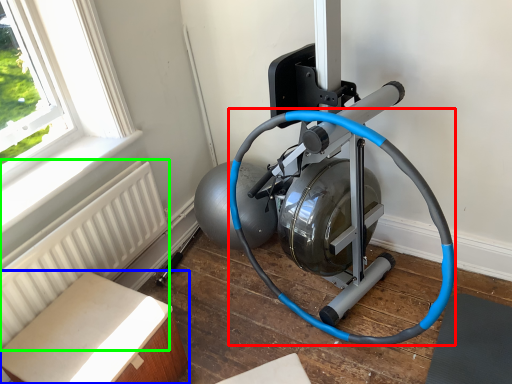
Question: Which is farther away from garden hose (highlighted by a red box)? furniture (highlighted by a blue box) or radiator (highlighted by a green box)?

Choices:
 (A) furniture
 (B) radiator

Answer: (A)